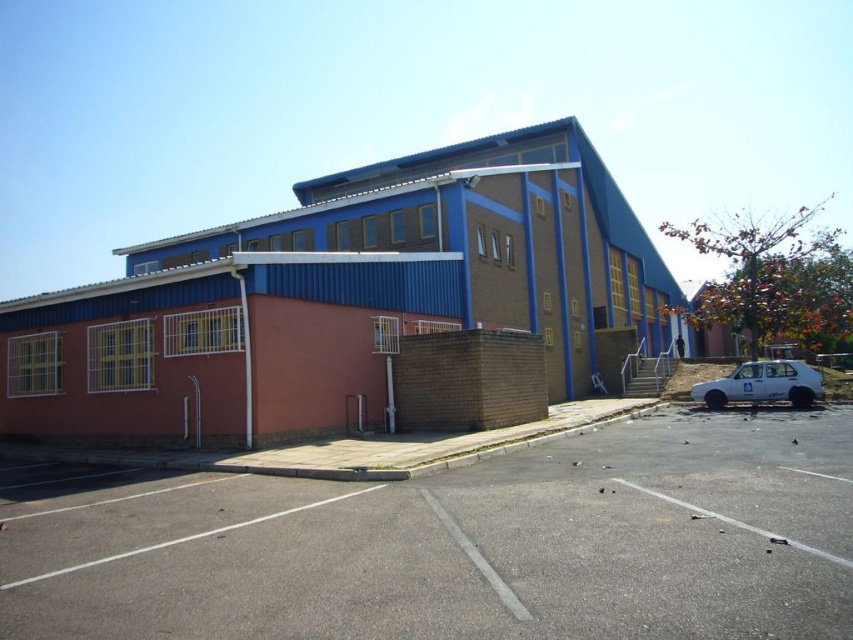
Does gray asphalt parking lot at center appear on the left side of white matte car at lower right?

Correct, you'll find gray asphalt parking lot at center to the left of white matte car at lower right.

Who is more distant from viewer, (634, 480) or (785, 369)?

Point (785, 369)

Is point (572, 531) more distant than point (751, 394)?

No, it is in front of (751, 394).

Identify the location of gray asphalt parking lot at center. (463, 545).